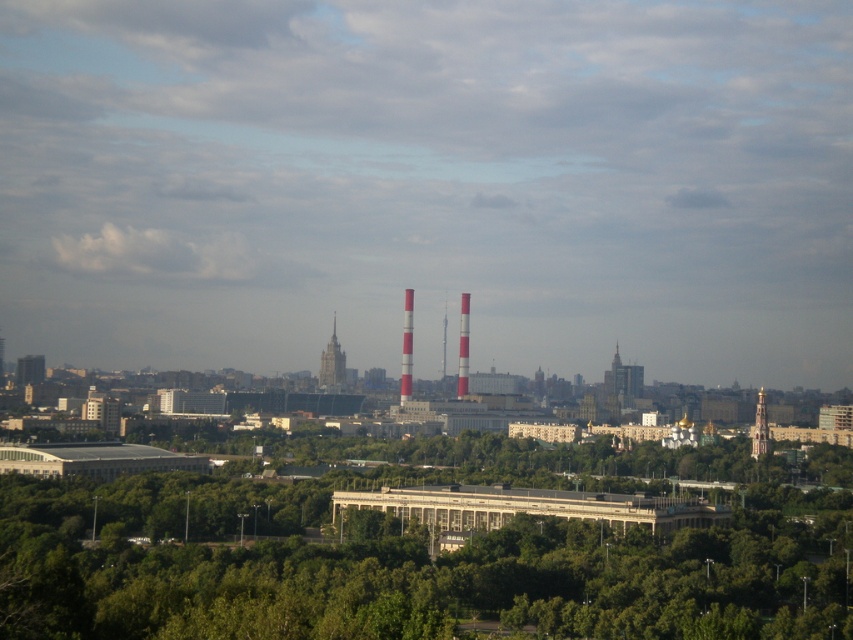
You are standing in the city park and want to take a photo of the white striped tower at center without the green leafy trees at center blocking the view. Which direction should you move to achieve this?

Move to the right side of the green leafy trees at center so they are no longer blocking the view of the white striped tower at center.

You are an architect analyzing the cityscape. From your vantage point in the park, you notice the gold textured dome at center and the white striped tower at center. Which structure appears closer to you?

The gold textured dome at center appears closer because the white striped tower at center is positioned behind it.